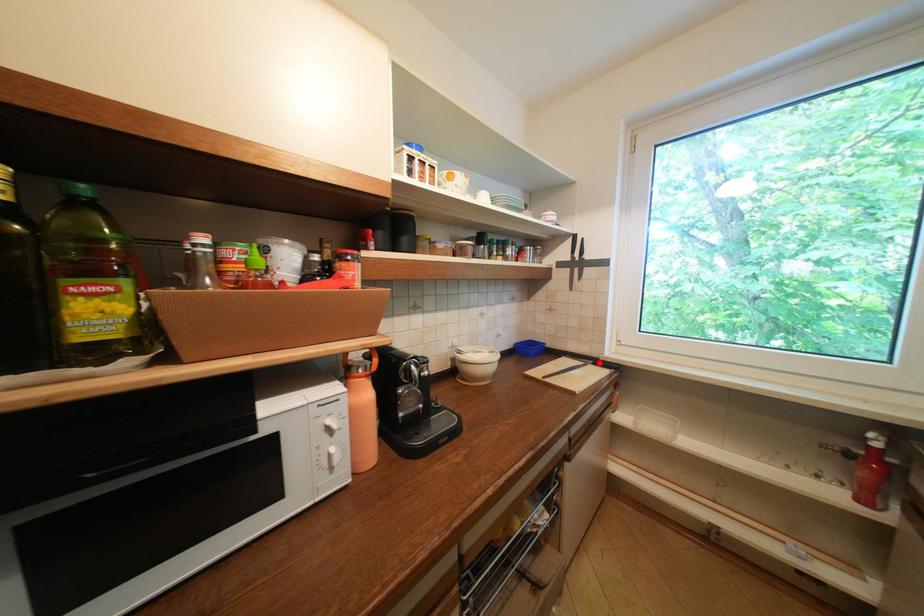
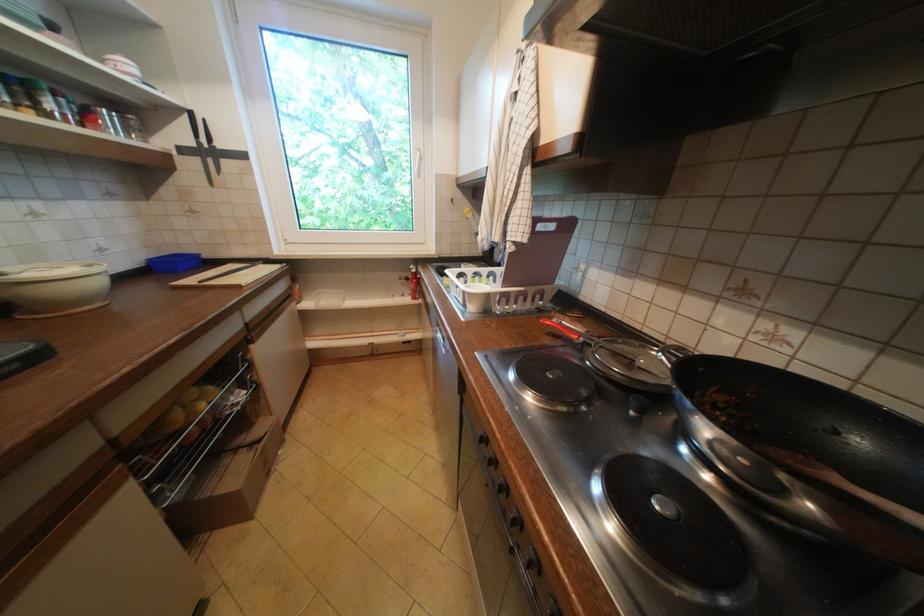
The point at the highlighted location is marked in the first image. Where is the corresponding point in the second image?

(270, 262)